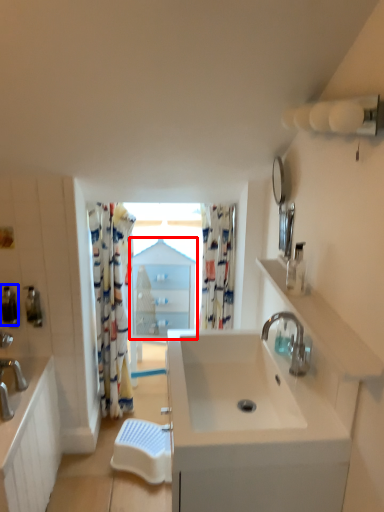
Question: Among these objects, which one is nearest to the camera, medicine cabinet (highlighted by a red box) or soap dispenser (highlighted by a blue box)?

Choices:
 (A) medicine cabinet
 (B) soap dispenser

Answer: (B)